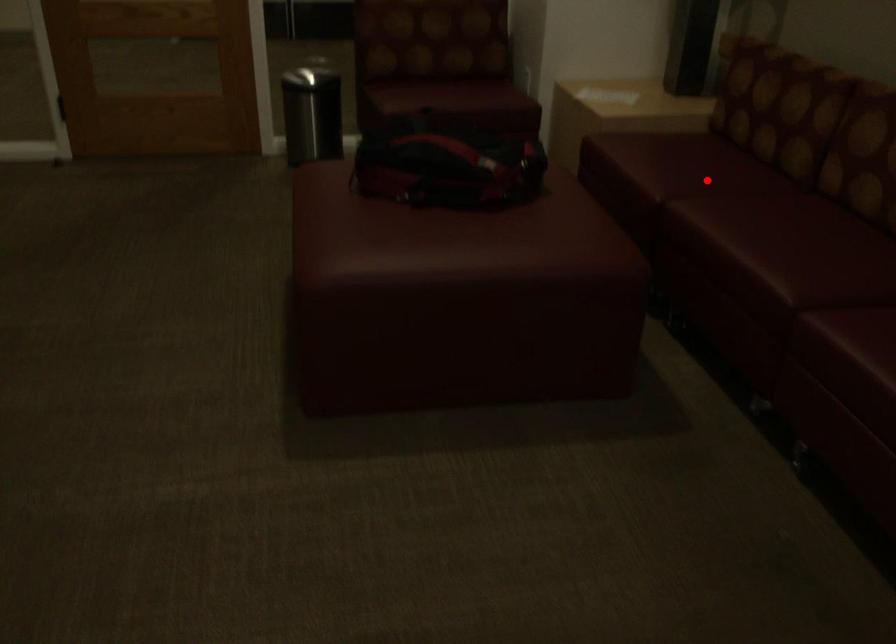
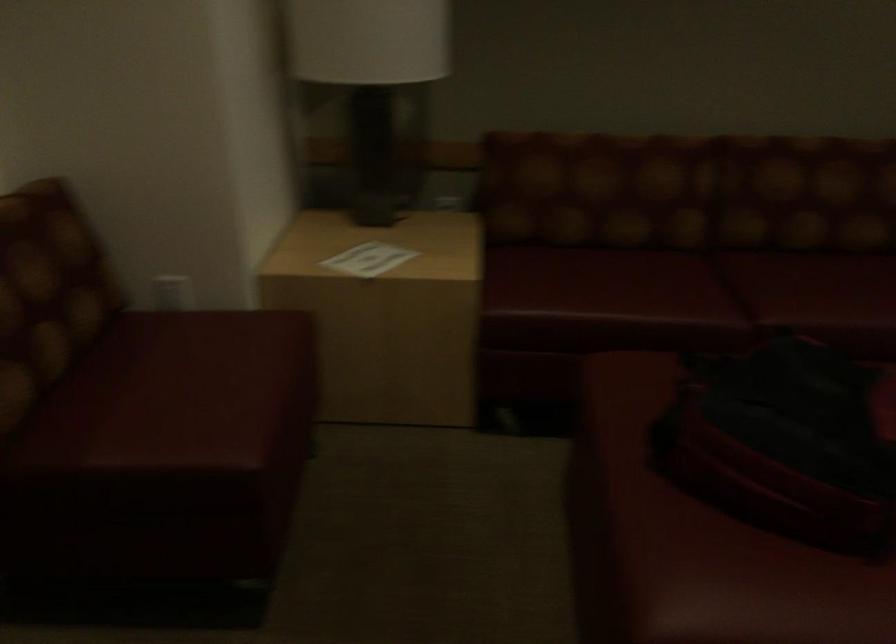
Find the pixel in the second image that matches the highlighted location in the first image.

(698, 286)